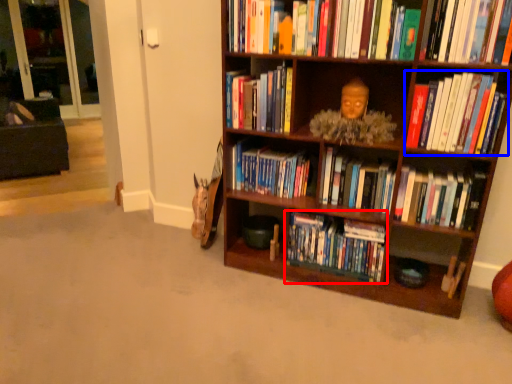
Question: Which point is further to the camera, book (highlighted by a red box) or book (highlighted by a blue box)?

Choices:
 (A) book
 (B) book

Answer: (A)